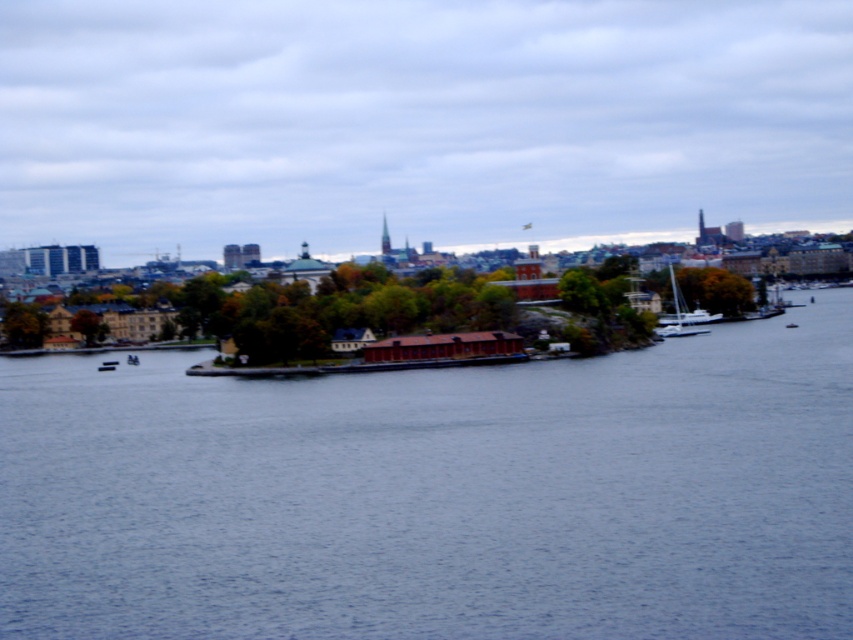
You are a photographer planning to capture the entire waterfront scene. You notice the blue water at center and the white glossy sailboat at right. Which object occupies a wider area in the image?

The blue water at center occupies a wider area in the image than the white glossy sailboat at right, as its width is larger according to the description.